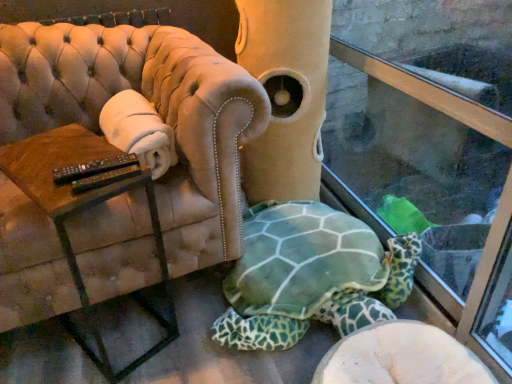
Question: Considering the positions of brown wooden table at left and velvet beige armchair at center in the image, is brown wooden table at left bigger or smaller than velvet beige armchair at center?

Choices:
 (A) big
 (B) small

Answer: (B)

Question: Considering the positions of brown wooden table at left and velvet beige armchair at center in the image, is brown wooden table at left taller or shorter than velvet beige armchair at center?

Choices:
 (A) short
 (B) tall

Answer: (A)

Question: Which object is the farthest from the transparent glass shop window at lower right?

Choices:
 (A) velvet beige armchair at center
 (B) brown wooden table at left
 (C) green fabric tortoise at center

Answer: (B)

Question: Which object is positioned farthest from the velvet beige armchair at center?

Choices:
 (A) brown wooden table at left
 (B) transparent glass shop window at lower right
 (C) green fabric tortoise at center

Answer: (B)